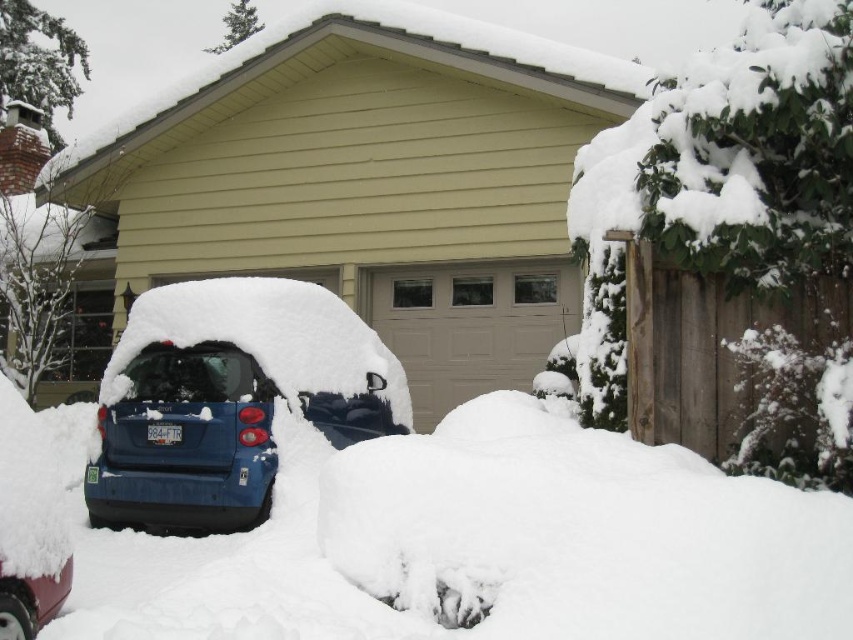
Question: Is the position of matte blue car at lower left less distant than that of shiny red car at lower left?

Choices:
 (A) no
 (B) yes

Answer: (A)

Question: Which object is farther from the camera taking this photo?

Choices:
 (A) matte blue car at center
 (B) shiny red car at lower left

Answer: (A)

Question: Does matte blue car at center have a larger size compared to matte blue car at lower left?

Choices:
 (A) no
 (B) yes

Answer: (B)

Question: Among these points, which one is nearest to the camera?

Choices:
 (A) (189, 387)
 (B) (209, 477)

Answer: (B)

Question: Does matte blue car at lower left have a lesser width compared to shiny red car at lower left?

Choices:
 (A) no
 (B) yes

Answer: (A)

Question: Which point appears farthest from the camera in this image?

Choices:
 (A) [27, 605]
 (B) [134, 515]
 (C) [294, 296]

Answer: (C)